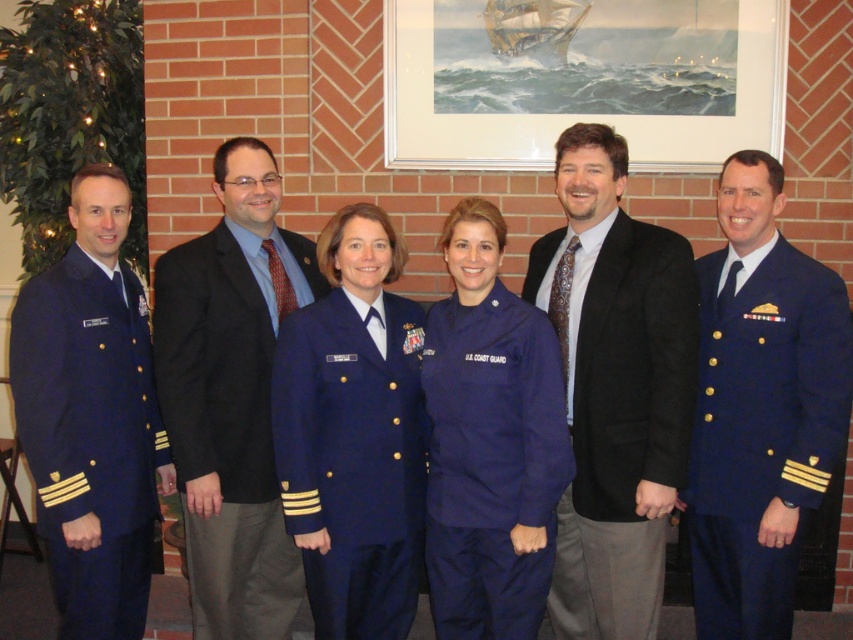
In the scene shown: Is dark brown suit at center to the right of navy blue woolen uniform at center from the viewer's perspective?

Yes, dark brown suit at center is to the right of navy blue woolen uniform at center.

Find the location of `dark brown suit at center`. dark brown suit at center is located at coordinates (614, 388).

Where is `dark brown suit at center`? Image resolution: width=853 pixels, height=640 pixels. dark brown suit at center is located at coordinates (614, 388).

In the scene shown: Does matte black suit at center have a lesser width compared to navy blue fabric us coast guard uniform at center?

Incorrect, matte black suit at center's width is not less than navy blue fabric us coast guard uniform at center's.

Which is more to the left, matte black suit at center or navy blue fabric us coast guard uniform at center?

matte black suit at center is more to the left.

Where is `matte black suit at center`? The image size is (853, 640). matte black suit at center is located at coordinates (231, 396).

Between navy blue woolen uniform at center and navy blue fabric us coast guard uniform at center, which one has less height?

With less height is navy blue woolen uniform at center.

Based on the photo, between navy blue woolen uniform at center and navy blue fabric us coast guard uniform at center, which one appears on the left side from the viewer's perspective?

Positioned to the left is navy blue woolen uniform at center.

Find the location of a particular element. navy blue woolen uniform at center is located at coordinates (352, 460).